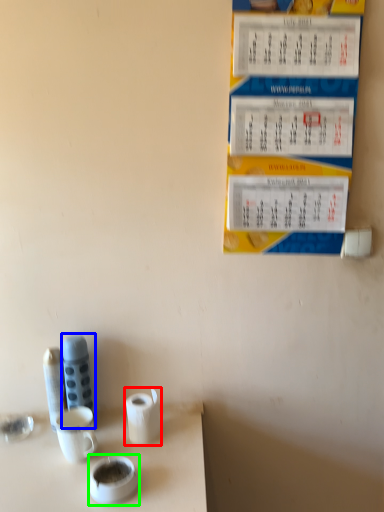
Question: Which object is positioned farthest from toilet paper (highlighted by a red box)? Select from stationery (highlighted by a blue box) and teacup (highlighted by a green box).

Choices:
 (A) stationery
 (B) teacup

Answer: (A)